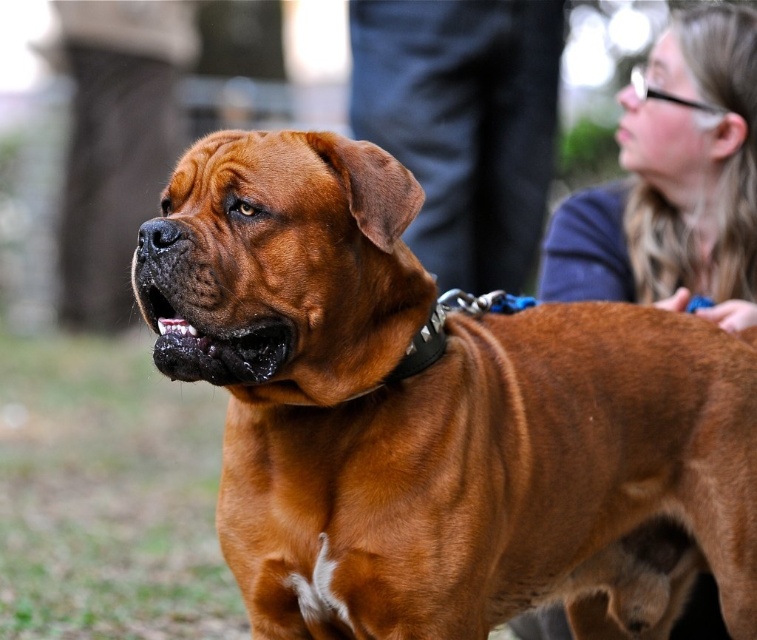
You are standing in front of the dog and want to place a treat between the two points, point (x=338, y=170) and point (x=681, y=202). Which point is closer to you where you should place the treat first?

Point (x=338, y=170) is closer to the viewer than point (x=681, y=202), so you should place the treat at point (x=338, y=170) first.

You are a photographer trying to capture a portrait of the brown leather dog at center and the smooth blue shirt at upper right. Based on their positions, which object is closer to the camera?

The brown leather dog at center is closer to the camera because it is positioned below the smooth blue shirt at upper right, indicating it is in a lower plane relative to the viewer.